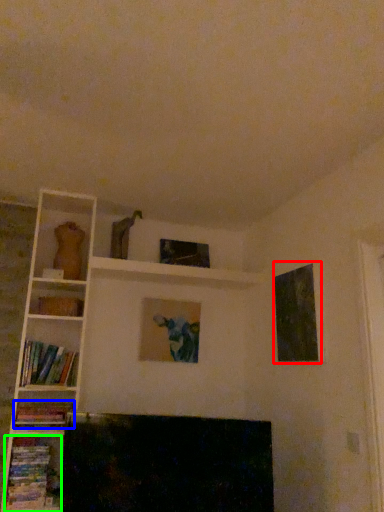
Question: Which object is positioned farthest from picture frame (highlighted by a red box)? Select from book (highlighted by a blue box) and book (highlighted by a green box).

Choices:
 (A) book
 (B) book

Answer: (B)